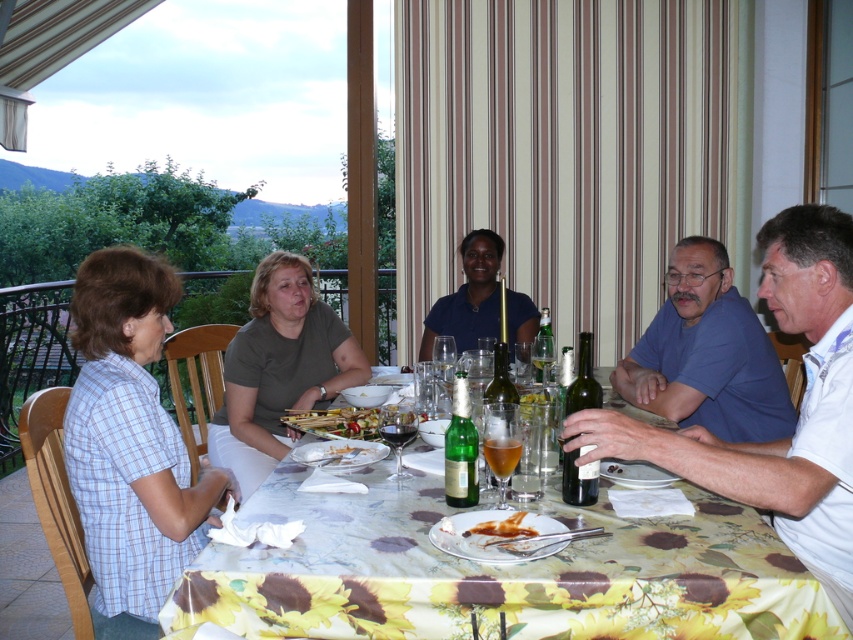
Does floral-patterned tablecloth at center have a smaller size compared to blue cotton shirt at upper right?

No, floral-patterned tablecloth at center is not smaller than blue cotton shirt at upper right.

The width and height of the screenshot is (853, 640). What are the coordinates of `floral-patterned tablecloth at center` in the screenshot? It's located at (496, 572).

Which is behind, point (732, 481) or point (415, 432)?

Point (415, 432)

Is the position of blue cotton shirt at right more distant than that of translucent glass wine at table center?

No, it is in front of translucent glass wine at table center.

Image resolution: width=853 pixels, height=640 pixels. Find the location of `blue cotton shirt at right`. blue cotton shirt at right is located at coordinates (799, 412).

Between blue cotton shirt at upper right and translucent glass beer at center, which one appears on the right side from the viewer's perspective?

Positioned to the right is blue cotton shirt at upper right.

The width and height of the screenshot is (853, 640). I want to click on blue cotton shirt at upper right, so click(706, 355).

Is point (614, 378) in front of point (514, 461)?

No, (614, 378) is behind (514, 461).

Locate an element on the screen. blue cotton shirt at upper right is located at coordinates (706, 355).